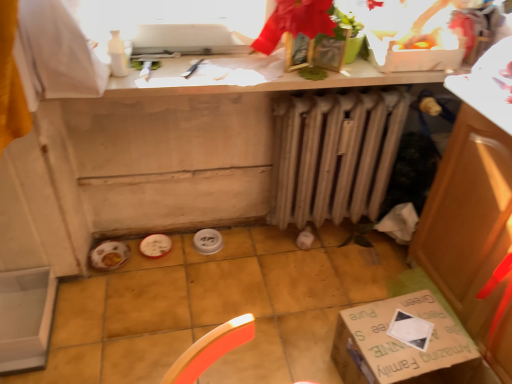
Question: From a real-world perspective, relative to white plastic box at upper center, is beige metallic radiator at center vertically above or below?

Choices:
 (A) below
 (B) above

Answer: (A)

Question: Which is correct: beige metallic radiator at center is inside white plastic box at upper center, or outside of it?

Choices:
 (A) outside
 (B) inside

Answer: (A)

Question: Which object is the farthest from the white matte countertop at upper center?

Choices:
 (A) green cardboard box at lower right
 (B) white plastic box at upper center
 (C) beige metallic radiator at center

Answer: (A)

Question: Which of these objects is positioned farthest from the white plastic box at upper center?

Choices:
 (A) green cardboard box at lower right
 (B) beige metallic radiator at center
 (C) white matte countertop at upper center

Answer: (A)